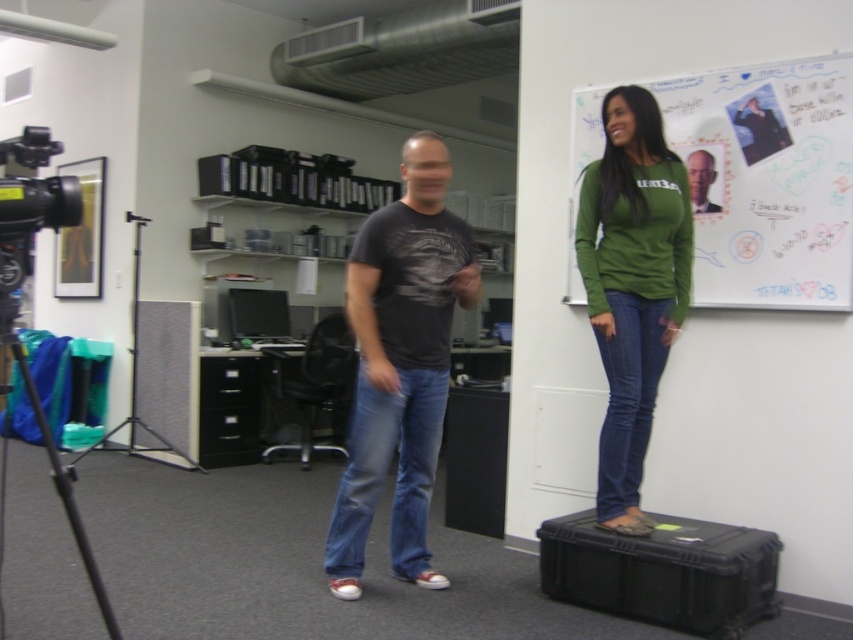
Question: Can you confirm if green matte whiteboard at upper right is positioned above black metal tripod at left?

Choices:
 (A) yes
 (B) no

Answer: (A)

Question: Among these points, which one is farthest from the camera?

Choices:
 (A) (599, 442)
 (B) (91, 449)
 (C) (374, 429)

Answer: (B)

Question: Which point is farther to the camera?

Choices:
 (A) (608, 346)
 (B) (692, 168)

Answer: (B)

Question: Is matte black t-shirt at center to the left of black metal tripod at left from the viewer's perspective?

Choices:
 (A) yes
 (B) no

Answer: (B)

Question: Is matte black t-shirt at center in front of green matte long-sleeve shirt at upper right?

Choices:
 (A) yes
 (B) no

Answer: (A)

Question: Estimate the real-world distances between objects in this image. Which object is farther from the green matte whiteboard at upper right?

Choices:
 (A) black metal tripod at left
 (B) black matte tripod at left
 (C) green matte long-sleeve shirt at upper right

Answer: (B)